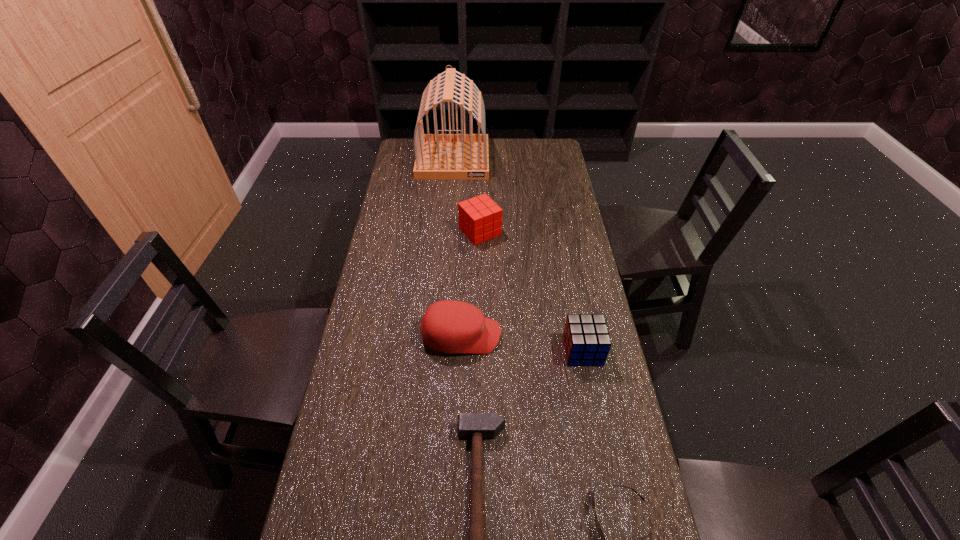
Where is `vacant area that lies between the nearer cube and the cap`? Image resolution: width=960 pixels, height=540 pixels. vacant area that lies between the nearer cube and the cap is located at coordinates (522, 343).

I want to click on vacant space that's between the birdcage and the cap, so click(x=457, y=248).

Identify the location of vacant area that lies between the farthest object and the right cube. The height and width of the screenshot is (540, 960). (517, 255).

The width and height of the screenshot is (960, 540). Find the location of `the closest object to the tallest object`. the closest object to the tallest object is located at coordinates (480, 218).

The width and height of the screenshot is (960, 540). What are the coordinates of `object that is the fourth closest one to the farthest object` in the screenshot? It's located at (476, 426).

Identify the location of free location that satisfies the following two spatial constraints: 1. on the front-facing side of the cap; 2. on the back side of the nearer cube. (461, 351).

Identify the location of free spot that satisfies the following two spatial constraints: 1. on the front-facing side of the cap; 2. on the back side of the nearer cube. (461, 351).

This screenshot has height=540, width=960. What are the coordinates of `vacant space that satisfies the following two spatial constraints: 1. on the back side of the nearer cube; 2. on the front-facing side of the cap` in the screenshot? It's located at (580, 336).

Image resolution: width=960 pixels, height=540 pixels. I want to click on free space that satisfies the following two spatial constraints: 1. with an open door on the farthest object; 2. on the left side of the nearer cube, so click(438, 351).